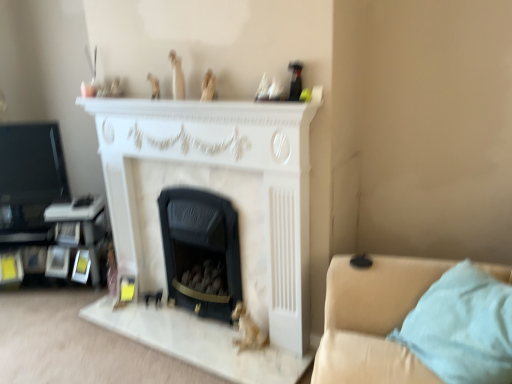
Locate an element on the screen. This screenshot has width=512, height=384. free space that is in between white matte statue at upper center, the first toy positioned from the top, and matte beige figurine at upper center, which is the 3th toy in top-to-bottom order is located at coordinates (195, 99).